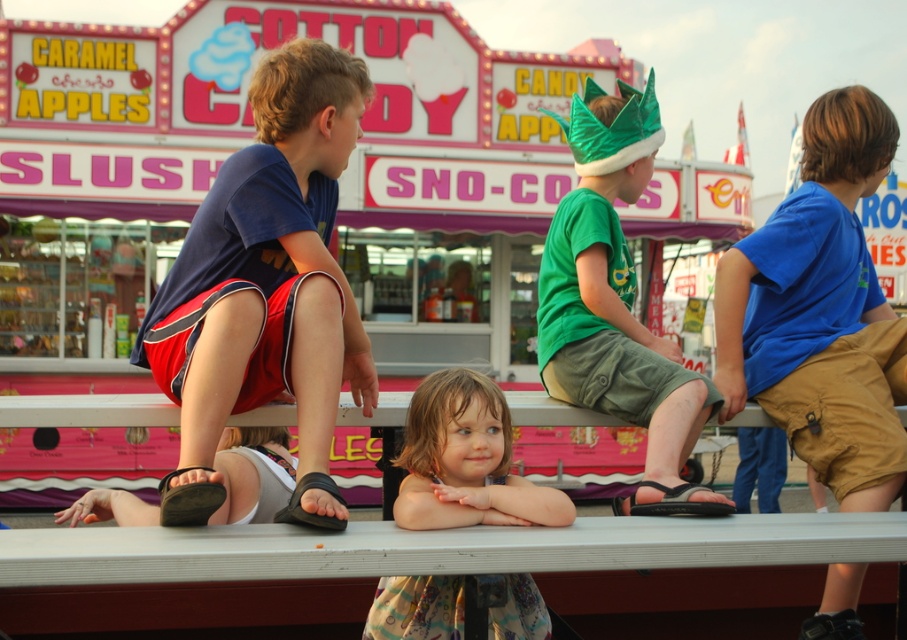
You are standing in the carnival scene and want to take a photo of both the point at (613, 611) and the point at (610, 154). Which point should you focus on first to ensure both are in clear view?

You should focus on point (613, 611) first because it is closer to the camera than point (610, 154), ensuring both points are in focus when using a camera with a fixed focal length.

You are organizing a costume party and need to arrange the children from the widest to narrowest based on their clothing. Given the blue cotton shirt at right and the light brown hair at center, which should come first?

The light brown hair at center should come first since its width is greater than the blue cotton shirt at right.